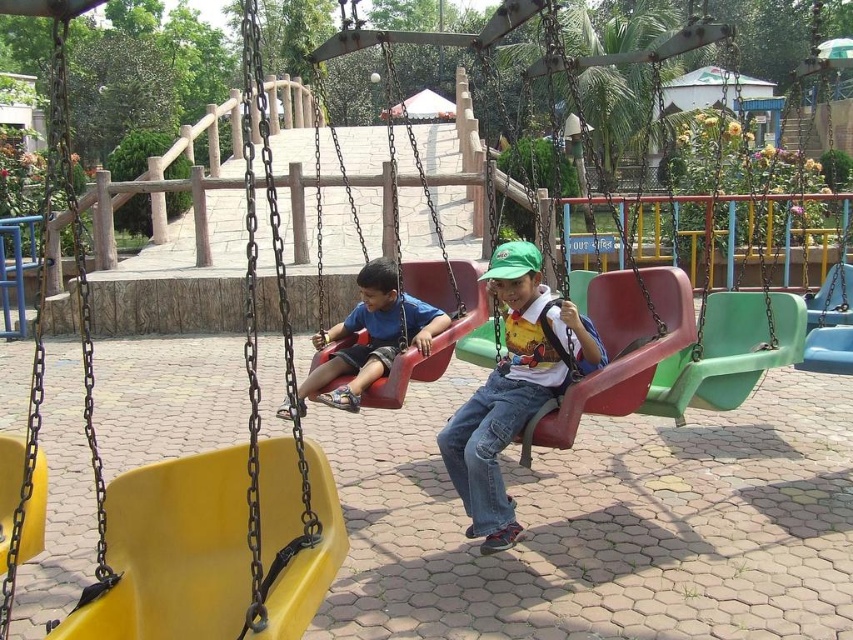
You are a photographer trying to capture a photo of the matte green cap at center and the matte blue shirt at center. Since you want to ensure both are clearly visible, which object should you focus on first to account for their sizes?

The matte green cap at center has a lesser width compared to matte blue shirt at center, so you should focus on the matte blue shirt at center first because it is larger and will require more attention to capture details clearly.

You are a photographer standing at the edge of the playground. You want to take a photo of the matte green cap at center and the matte blue shirt at center so that both are clearly visible. Based on their positions, which object should you focus on first to ensure both are in the frame?

The matte green cap at center is positioned under the matte blue shirt at center, so you should focus on the matte blue shirt at center first to ensure both are in the frame.

You are a photographer standing at the playground. You want to take a photo that includes both the matte green cap at center and the matte blue shirt at center. Which object should you focus on first to ensure both are in sharp focus?

You should focus on the matte green cap at center first because it is closer to the viewer than the matte blue shirt at center. By focusing on the closer object, the farther one will still be within the depth of field and appear sharp.